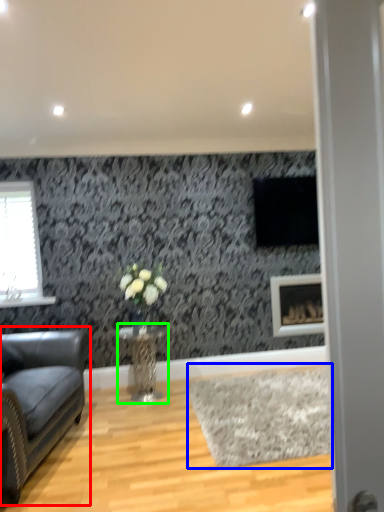
Question: Considering the real-world distances, which object is closest to studio couch (highlighted by a red box)? plain (highlighted by a blue box) or table (highlighted by a green box).

Choices:
 (A) plain
 (B) table

Answer: (B)